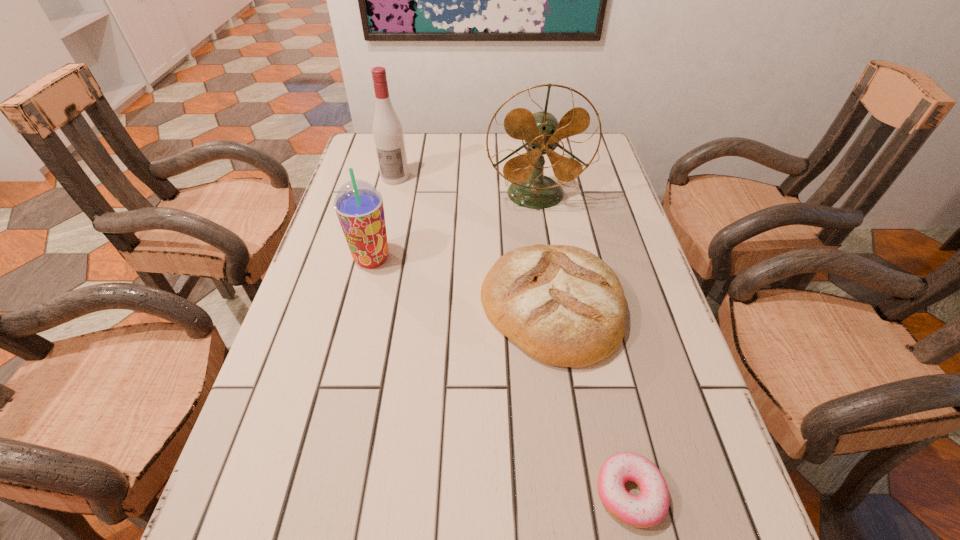
The width and height of the screenshot is (960, 540). Identify the location of fan. (530, 188).

Identify the location of alcohol. This screenshot has height=540, width=960. (387, 130).

The height and width of the screenshot is (540, 960). In order to click on the third tallest object in this screenshot , I will do `click(358, 204)`.

This screenshot has width=960, height=540. Identify the location of bread. (564, 306).

Locate an element on the screen. the nearest object is located at coordinates pos(649,508).

Find the location of a particular element. This screenshot has height=540, width=960. doughnut is located at coordinates [649, 508].

This screenshot has height=540, width=960. Find the location of `vacant space located in front of the fan, directing air flow`. vacant space located in front of the fan, directing air flow is located at coordinates pos(545,262).

Find the location of a particular element. free location located 0.250m on the label of the alcohol is located at coordinates (380, 241).

I want to click on vacant space positioned on the right of the third shortest object, so click(x=557, y=259).

Where is `vacant position located on the front of the second shortest object`? Image resolution: width=960 pixels, height=540 pixels. vacant position located on the front of the second shortest object is located at coordinates (565, 404).